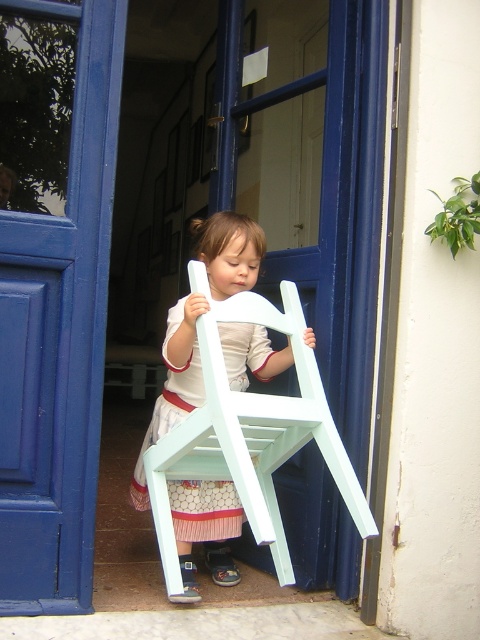
Question: Does blue wooden door at center appear on the left side of matte white chair at center?

Choices:
 (A) no
 (B) yes

Answer: (B)

Question: Can you confirm if blue wooden door at center is positioned to the left of matte white chair at center?

Choices:
 (A) no
 (B) yes

Answer: (B)

Question: Among these points, which one is farthest from the camera?

Choices:
 (A) (177, 314)
 (B) (36, 456)

Answer: (A)

Question: Among these points, which one is farthest from the camera?

Choices:
 (A) click(97, 380)
 (B) click(181, 506)

Answer: (B)

Question: In this image, where is blue wooden door at center located relative to matte white chair at center?

Choices:
 (A) right
 (B) left

Answer: (B)